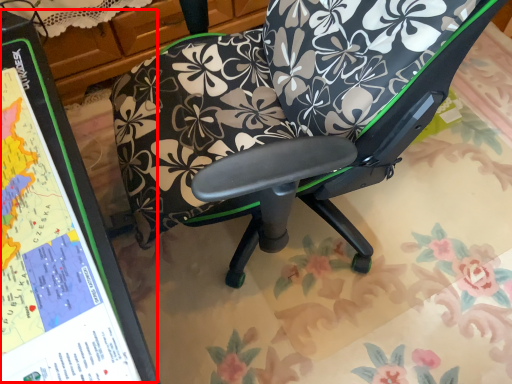
Question: From the image's perspective, considering the relative positions of bulletin board (annotated by the red box) and chair in the image provided, where is bulletin board (annotated by the red box) located with respect to the staircase?

Choices:
 (A) below
 (B) above

Answer: (A)